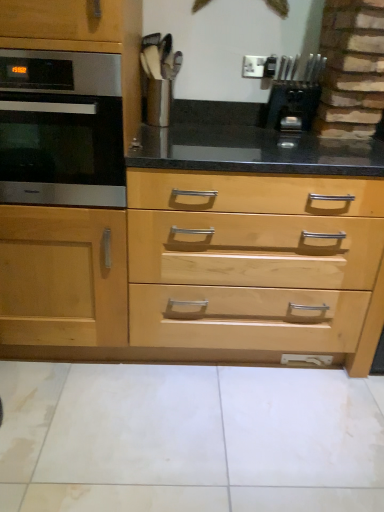
Find the location of `black plastic knife block at upper right`. black plastic knife block at upper right is located at coordinates (292, 104).

Which is correct: black plastic knife block at upper right is inside satin black oven at left, or outside of it?

black plastic knife block at upper right is located beyond the bounds of satin black oven at left.

Consider the image. Which is behind, black plastic knife block at upper right or satin black oven at left?

black plastic knife block at upper right is further away from the camera.

Is black plastic knife block at upper right facing away from satin black oven at left?

That's not correct — black plastic knife block at upper right is not looking away from satin black oven at left.

Considering the relative sizes of black plastic knife block at upper right and satin black oven at left in the image provided, is black plastic knife block at upper right smaller than satin black oven at left?

Correct, black plastic knife block at upper right occupies less space than satin black oven at left.

Is natural wood drawer at center looking in the opposite direction of satin black oven at left?

natural wood drawer at center is not turned away from satin black oven at left.

Can you tell me how much natural wood drawer at center and satin black oven at left differ in facing direction?

The angle between the facing direction of natural wood drawer at center and the facing direction of satin black oven at left is 0.000787 degrees.

Is the depth of natural wood drawer at center less than that of satin black oven at left?

No, natural wood drawer at center is further to the viewer.

Find the location of a particular element. The image size is (384, 512). cabinetry above the natural wood drawer at center (from the image's perspective) is located at coordinates (68, 100).

Which object is positioned more to the left, satin black oven at left or black plastic knife block at upper right?

satin black oven at left is more to the left.

Is satin black oven at left facing away from black plastic knife block at upper right?

No.

Can you tell me how much satin black oven at left and black plastic knife block at upper right differ in facing direction?

The angle between the facing direction of satin black oven at left and the facing direction of black plastic knife block at upper right is 0.00152 degrees.

Is satin black oven at left wider than black plastic knife block at upper right?

Yes.

Are black plastic knife block at upper right and natural wood drawer at center located far from each other?

No.

Is black plastic knife block at upper right not within natural wood drawer at center?

No, black plastic knife block at upper right is inside or overlapping with natural wood drawer at center.

From the image's perspective, is black plastic knife block at upper right above or below natural wood drawer at center?

black plastic knife block at upper right is above natural wood drawer at center.

Which is closer, (196,237) or (316,104)?

Point (196,237) appears to be closer to the viewer than point (316,104).

Is natural wood drawer at center next to black plastic knife block at upper right and touching it?

natural wood drawer at center is not next to black plastic knife block at upper right, and they're not touching.

In terms of width, does natural wood drawer at center look wider or thinner when compared to black plastic knife block at upper right?

In the image, natural wood drawer at center appears to be wider than black plastic knife block at upper right.

Considering the relative sizes of natural wood drawer at center and black plastic knife block at upper right in the image provided, is natural wood drawer at center smaller than black plastic knife block at upper right?

No.

Which is in front, point (86, 161) or point (258, 343)?

The point (86, 161) is closer to the camera.

Is satin black oven at left situated inside natural wood drawer at center or outside?

satin black oven at left lies outside natural wood drawer at center.

In terms of height, does satin black oven at left look taller or shorter compared to natural wood drawer at center?

Clearly, satin black oven at left is shorter compared to natural wood drawer at center.

At what (x,y) coordinates should I click in order to perform the action: click on appliance above the satin black oven at left (from a real-world perspective). Please return your answer as a coordinate pair (x, y). This screenshot has height=512, width=384. Looking at the image, I should click on (292, 104).

In order to click on drawer below the satin black oven at left (from the image's perspective) in this screenshot , I will do `click(251, 260)`.

Which object lies further to the anchor point black plastic knife block at upper right, natural wood drawer at center or satin black oven at left?

satin black oven at left is positioned further to the anchor black plastic knife block at upper right.

Which object lies nearer to the anchor point satin black oven at left, black plastic knife block at upper right or natural wood drawer at center?

natural wood drawer at center lies closer to satin black oven at left than the other object.

Estimate the real-world distances between objects in this image. Which object is further from natural wood drawer at center, satin black oven at left or black plastic knife block at upper right?

Based on the image, black plastic knife block at upper right appears to be further to natural wood drawer at center.

Considering their positions, is satin black oven at left positioned closer to black plastic knife block at upper right than natural wood drawer at center?

Among the two, natural wood drawer at center is located nearer to black plastic knife block at upper right.

Considering their positions, is natural wood drawer at center positioned closer to satin black oven at left than black plastic knife block at upper right?

natural wood drawer at center is positioned closer to the anchor satin black oven at left.

Based on their spatial positions, is black plastic knife block at upper right or satin black oven at left further from natural wood drawer at center?

black plastic knife block at upper right lies further to natural wood drawer at center than the other object.

Where is `drawer between satin black oven at left and black plastic knife block at upper right in the horizontal direction`? This screenshot has width=384, height=512. drawer between satin black oven at left and black plastic knife block at upper right in the horizontal direction is located at coordinates (251, 260).